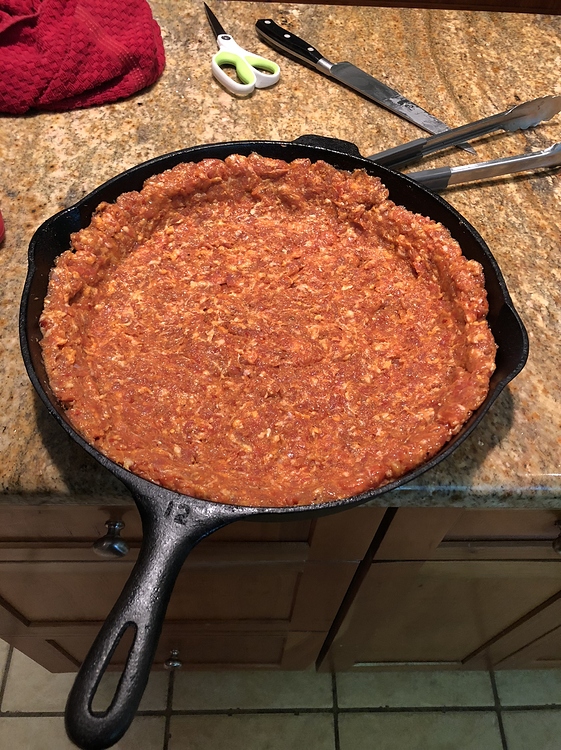
The width and height of the screenshot is (561, 750). I want to click on knob, so click(x=109, y=546).